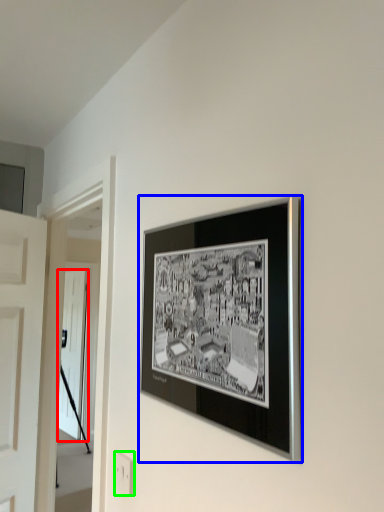
Question: Which object is the farthest from door (highlighted by a red box)? Choose among these: picture frame (highlighted by a blue box) or electric outlet (highlighted by a green box).

Choices:
 (A) picture frame
 (B) electric outlet

Answer: (A)